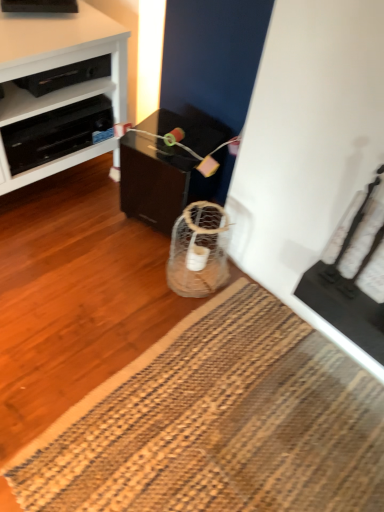
What are the coordinates of `vacant area that lies between black glossy table at center and natural fiber mat at lower center` in the screenshot? It's located at (122, 321).